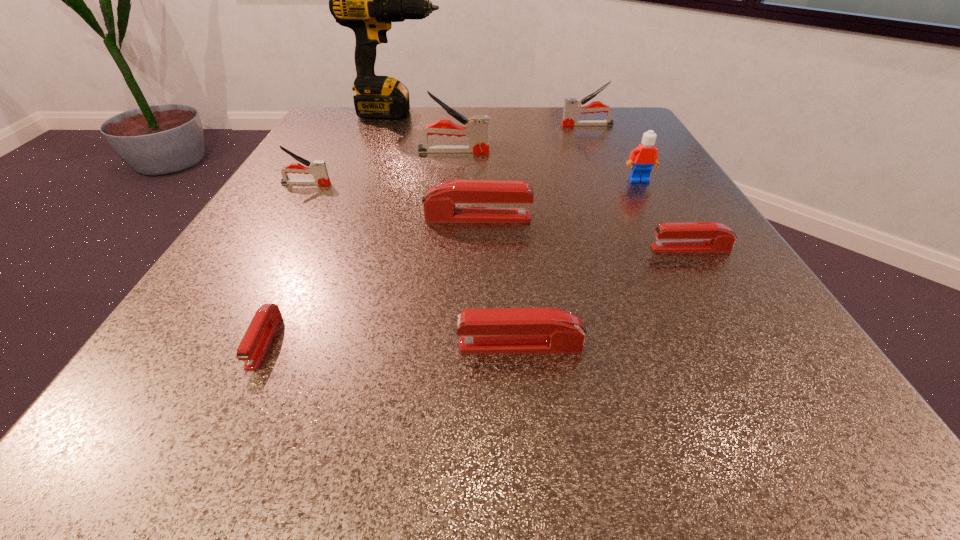
Locate an element on the screen. red stapler identified as the fourth closest to the nearest gray stapler is located at coordinates (704, 236).

Point out which red stapler is positioned as the third nearest to the third shortest stapler. Please provide its 2D coordinates. Your answer should be formatted as a tuple, i.e. [(x, y)], where the tuple contains the x and y coordinates of a point satisfying the conditions above.

[(439, 203)]

Where is `free point that satisfies the following two spatial constraints: 1. on the face of the Lego; 2. on the front-facing side of the fourth nearest stapler`? This screenshot has width=960, height=540. free point that satisfies the following two spatial constraints: 1. on the face of the Lego; 2. on the front-facing side of the fourth nearest stapler is located at coordinates (660, 218).